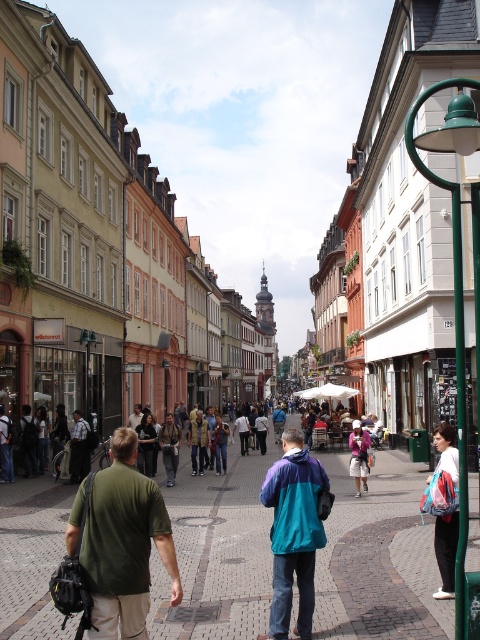
You are a delivery person carrying a package and need to walk from the brick paved at center to the white cotton hoodie at lower right. Is the path between them wide enough for you to pass through comfortably?

The brick paved at center might be wider than white cotton hoodie at lower right, so the path between them could be wide enough for you to pass through comfortably.

You are a tailor observing a person standing in the center of the street. You need to determine which clothing item, the green fabric shirt at center or the khaki cotton pants at center, reaches higher on the person. Which one is taller?

The green fabric shirt at center is taller than the khaki cotton pants at center.